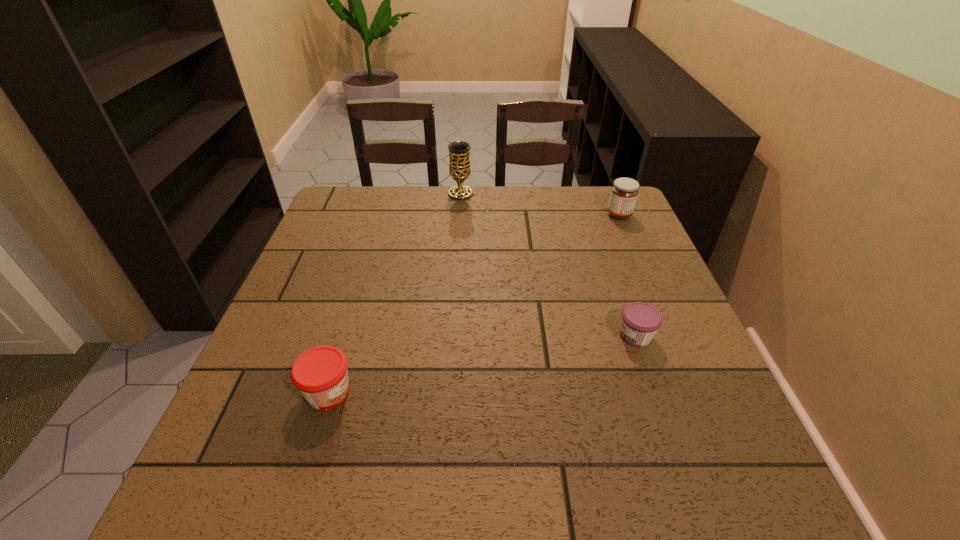
At what (x,y) coordinates should I click in order to perform the action: click on chalice. Please return your answer as a coordinate pair (x, y). Looking at the image, I should click on (459, 151).

Identify the location of the tallest object. The image size is (960, 540). (459, 151).

This screenshot has width=960, height=540. In order to click on the third shortest object in this screenshot , I will do point(624,192).

Image resolution: width=960 pixels, height=540 pixels. What are the coordinates of `the farthest jam` in the screenshot? It's located at (624, 192).

Find the location of a particular element. the third tallest object is located at coordinates (321, 375).

Locate an element on the screen. the nearest jam is located at coordinates (321, 375).

In order to click on the second farthest jam in this screenshot , I will do `click(640, 321)`.

At what (x,y) coordinates should I click in order to perform the action: click on the shortest object. Please return your answer as a coordinate pair (x, y). Looking at the image, I should click on (640, 321).

At what (x,y) coordinates should I click in order to perform the action: click on vacant space located on the right of the farthest object. Please return your answer as a coordinate pair (x, y). The height and width of the screenshot is (540, 960). Looking at the image, I should click on (591, 193).

You are a GUI agent. You are given a task and a screenshot of the screen. Output one action in this format:
    pyautogui.click(x=<x>, y=<y>)
    Task: Click on the free space located 0.170m on the front of the farthest jam
    The width and height of the screenshot is (960, 540).
    Given the screenshot: What is the action you would take?
    pyautogui.click(x=638, y=259)